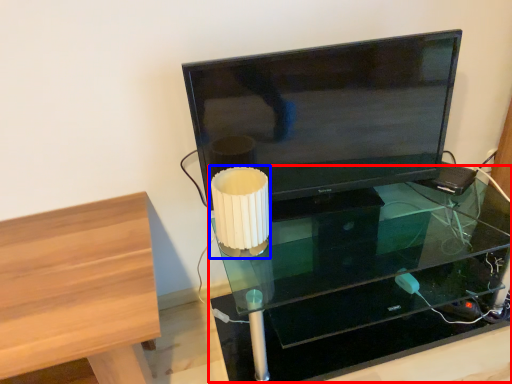
Question: Among these objects, which one is farthest to the camera, table (highlighted by a red box) or table lamp (highlighted by a blue box)?

Choices:
 (A) table
 (B) table lamp

Answer: (B)